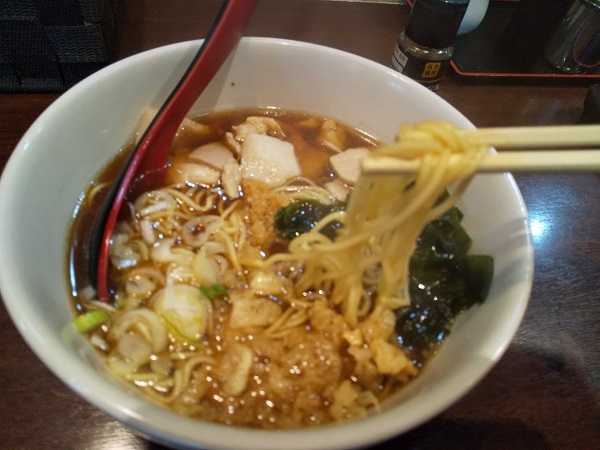
The width and height of the screenshot is (600, 450). What are the coordinates of `glass` in the screenshot? It's located at (565, 42).